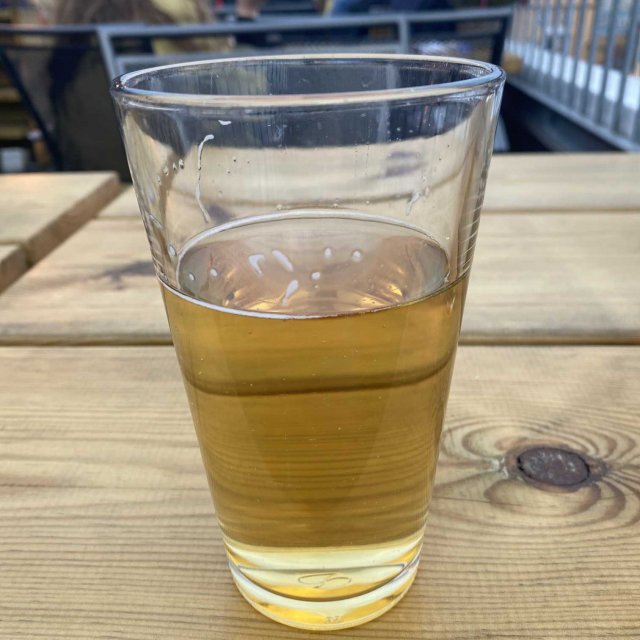
Find the location of a particular element. This screenshot has width=640, height=640. glass is located at coordinates (348, 607).